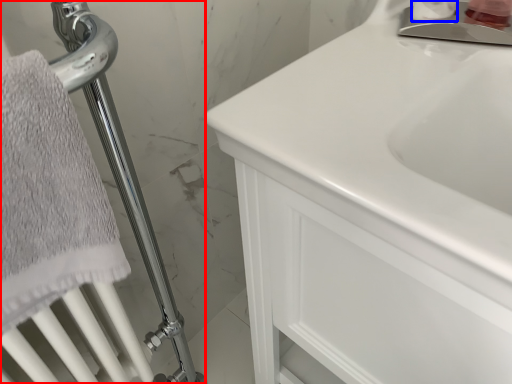
Question: Which object appears farthest to the camera in this image, shower (highlighted by a red box) or toiletry (highlighted by a blue box)?

Choices:
 (A) shower
 (B) toiletry

Answer: (B)